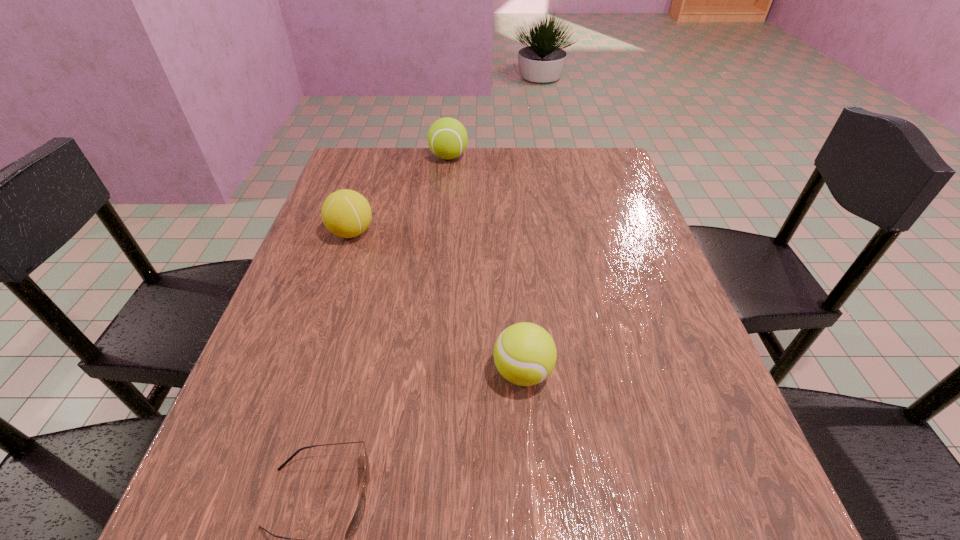
Where is `free space between the leftmost tennis ball and the farthest object`? This screenshot has width=960, height=540. free space between the leftmost tennis ball and the farthest object is located at coordinates (400, 195).

At what (x,y) coordinates should I click in order to perform the action: click on free space between the rightmost tennis ball and the second object from right to left. Please return your answer as a coordinate pair (x, y). Image resolution: width=960 pixels, height=540 pixels. Looking at the image, I should click on (486, 265).

Find the location of a particular element. This screenshot has width=960, height=540. free space between the farthest tennis ball and the leftmost tennis ball is located at coordinates (x=400, y=195).

In order to click on object that ranks as the second closest to the nearest tennis ball in this screenshot , I will do `click(346, 213)`.

Where is `object that ranks as the closest to the shortest object`? This screenshot has width=960, height=540. object that ranks as the closest to the shortest object is located at coordinates (525, 354).

Locate which tennis ball ranks second in proximity to the nearest object. Please provide its 2D coordinates. Your answer should be formatted as a tuple, i.e. [(x, y)], where the tuple contains the x and y coordinates of a point satisfying the conditions above.

[(346, 213)]

Where is `the closest tennis ball relative to the farthest tennis ball`? Image resolution: width=960 pixels, height=540 pixels. the closest tennis ball relative to the farthest tennis ball is located at coordinates pos(346,213).

Where is `vacant space that satisfies the following two spatial constraints: 1. on the front side of the nearest tennis ball; 2. on the right side of the leftmost tennis ball`? vacant space that satisfies the following two spatial constraints: 1. on the front side of the nearest tennis ball; 2. on the right side of the leftmost tennis ball is located at coordinates (304, 372).

Identify the location of vacant area that satisfies the following two spatial constraints: 1. on the front side of the second farthest tennis ball; 2. on the right side of the nearest tennis ball. (304, 372).